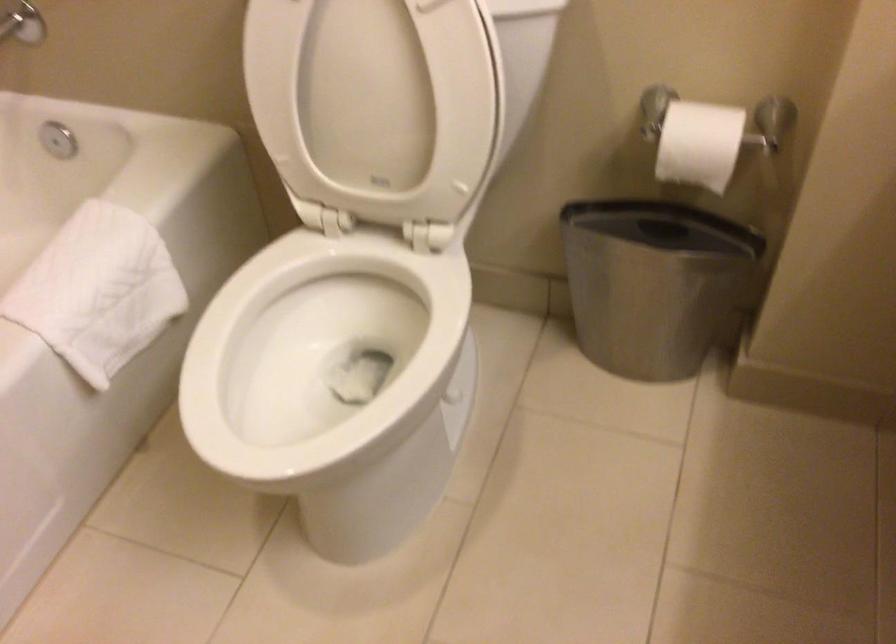
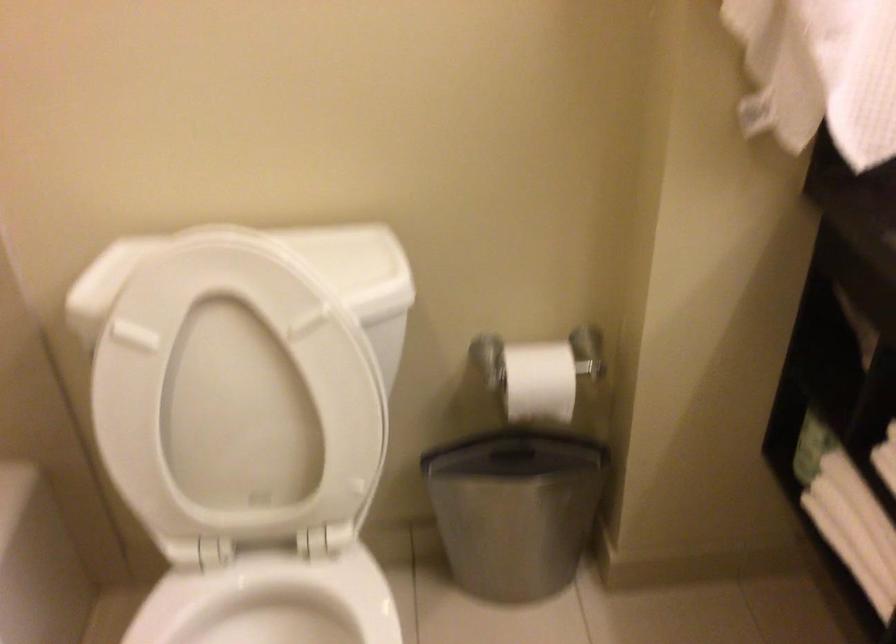
Question: Based on the continuous images, in which direction is the camera rotating? Reply with the corresponding letter.

Choices:
 (A) Left
 (B) Right
 (C) Up
 (D) Down

Answer: (B)